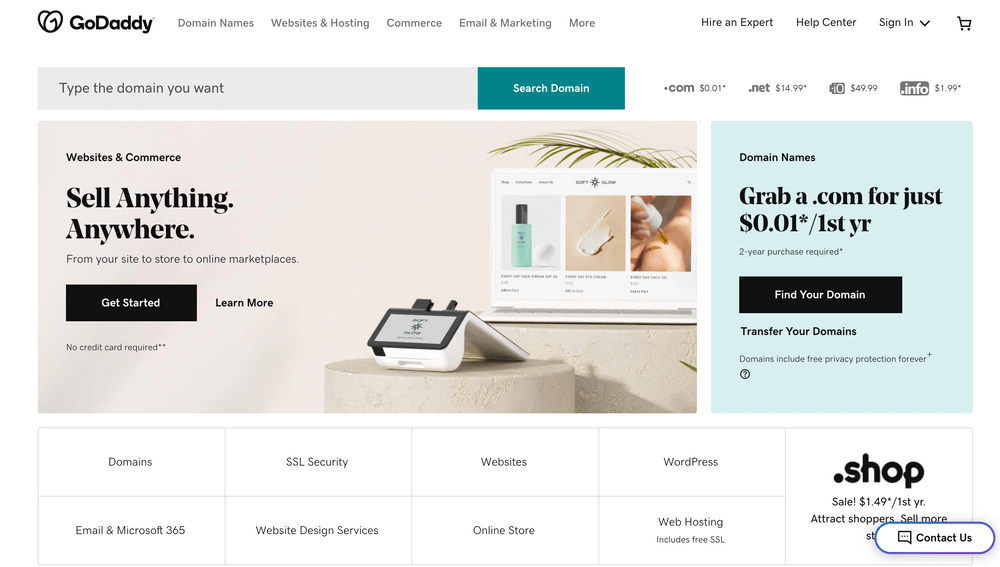
Find the location of a particular element. bottle is located at coordinates (519, 238).